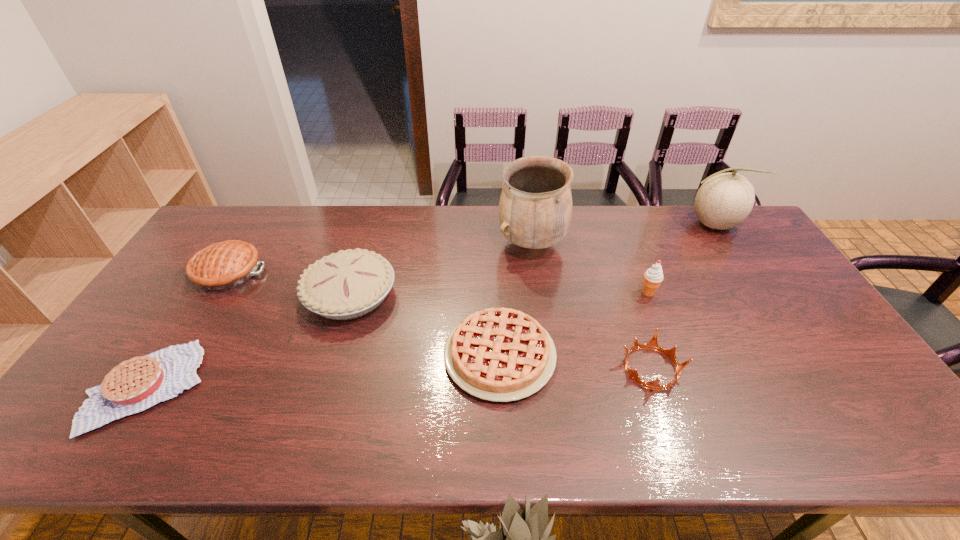
This screenshot has height=540, width=960. Find the location of `blank space that satisfies the following two spatial constraints: 1. on the back side of the rightmost object; 2. on the right side of the fifth tallest object`. blank space that satisfies the following two spatial constraints: 1. on the back side of the rightmost object; 2. on the right side of the fifth tallest object is located at coordinates (257, 225).